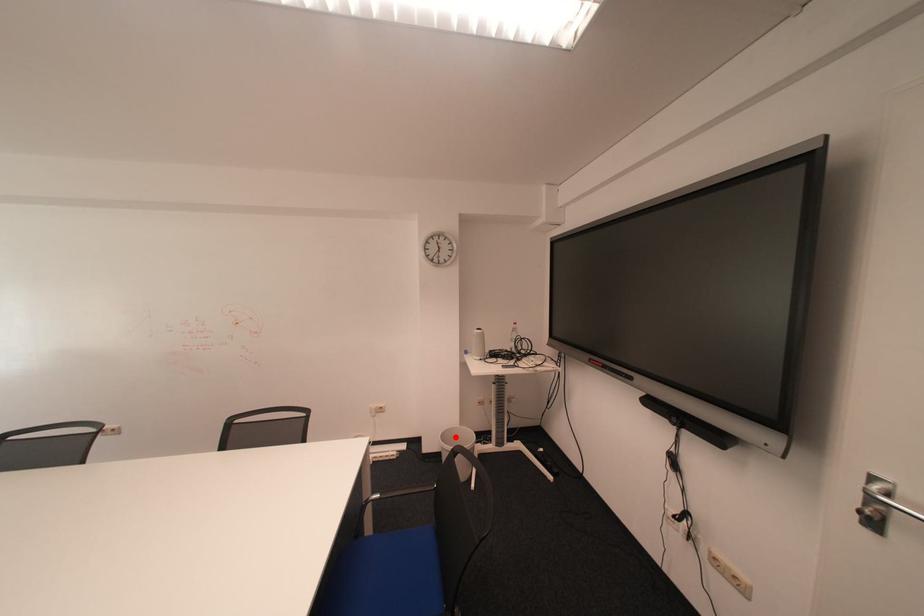
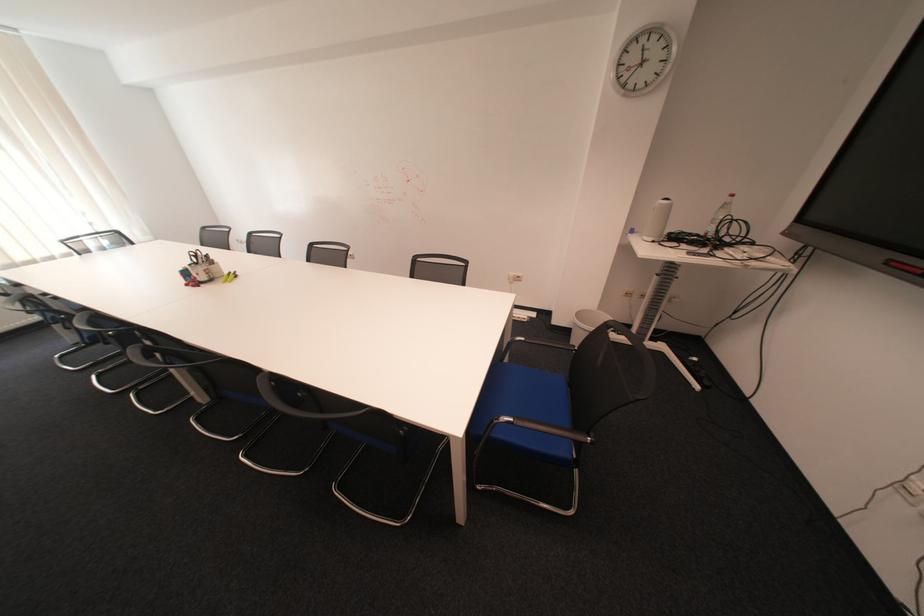
Question: I am providing you with two images of the same scene from different viewpoints. In image1, a red point is highlighted. Considering the same 3D point in image2, which of the following is correct?

Choices:
 (A) It is closer
 (B) It is farther

Answer: (A)